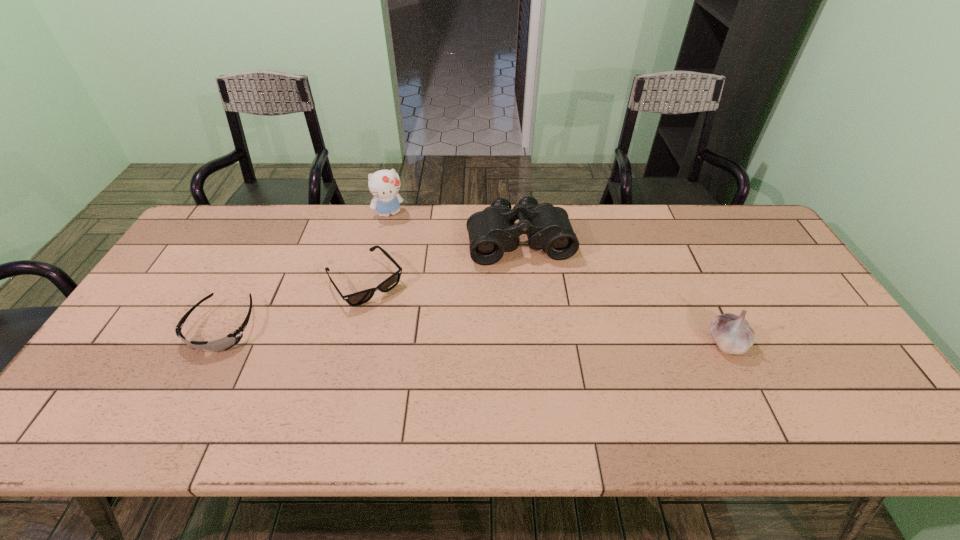
Locate an element on the screen. free space located on the front-facing side of the kitten is located at coordinates (428, 292).

This screenshot has height=540, width=960. I want to click on blank area located on the front-facing side of the kitten, so click(x=418, y=269).

Image resolution: width=960 pixels, height=540 pixels. What are the coordinates of `blank space located 0.200m at the eyepieces of the binoculars` in the screenshot? It's located at (540, 318).

Where is `vacant region located 0.120m at the eyepieces of the binoculars`? This screenshot has width=960, height=540. vacant region located 0.120m at the eyepieces of the binoculars is located at coordinates (536, 296).

I want to click on free space located at the eyepieces of the binoculars, so click(x=541, y=320).

Locate an element on the screen. The image size is (960, 540). free space located on the front-facing side of the second shortest object is located at coordinates (427, 357).

This screenshot has width=960, height=540. In order to click on blank space located 0.370m on the front-facing side of the second shortest object in this screenshot , I will do `click(463, 400)`.

I want to click on vacant space located 0.300m on the front-facing side of the second shortest object, so click(x=445, y=380).

You are a GUI agent. You are given a task and a screenshot of the screen. Output one action in this format:
    pyautogui.click(x=<x>, y=<y>)
    Task: Click on the kitten located in the far edge section of the desktop
    
    Given the screenshot: What is the action you would take?
    pyautogui.click(x=384, y=184)

What are the coordinates of `binoculars that is at the far edge` in the screenshot? It's located at (492, 232).